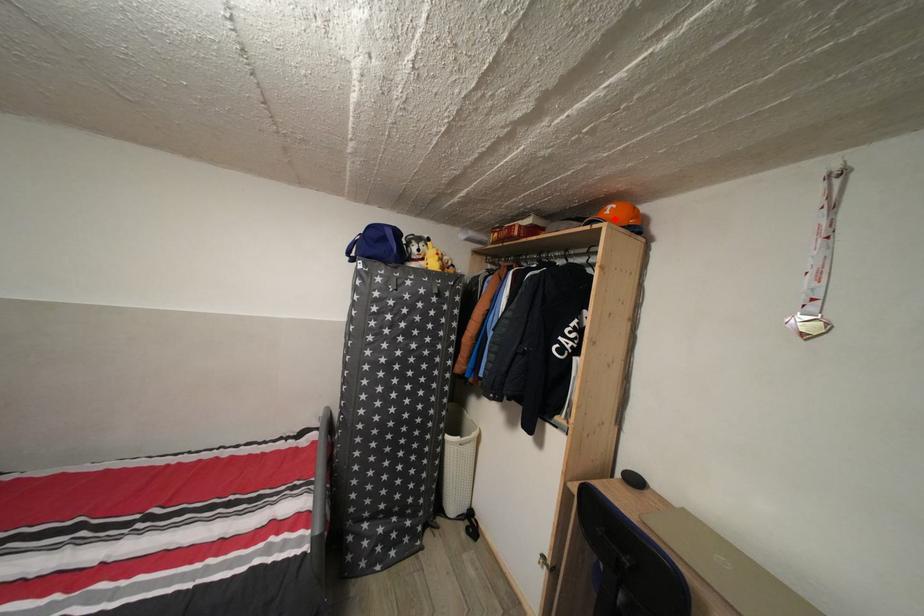
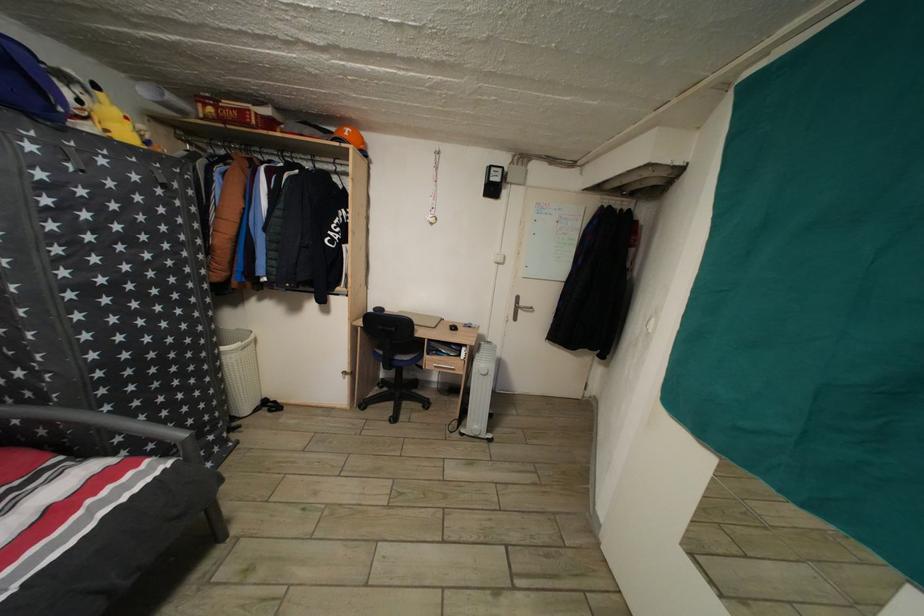
Locate, in the second image, the point that corresponds to the highlighted location in the first image.

(354, 140)